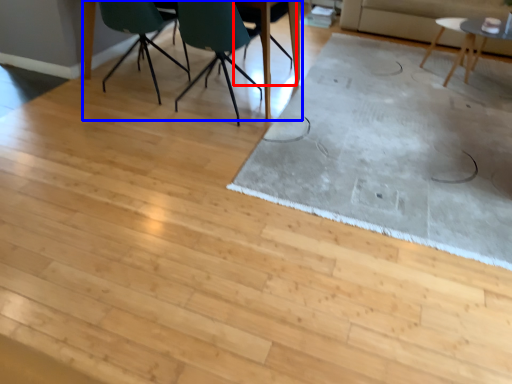
Question: Which object is further to the camera taking this photo, chair (highlighted by a red box) or table (highlighted by a blue box)?

Choices:
 (A) chair
 (B) table

Answer: (A)